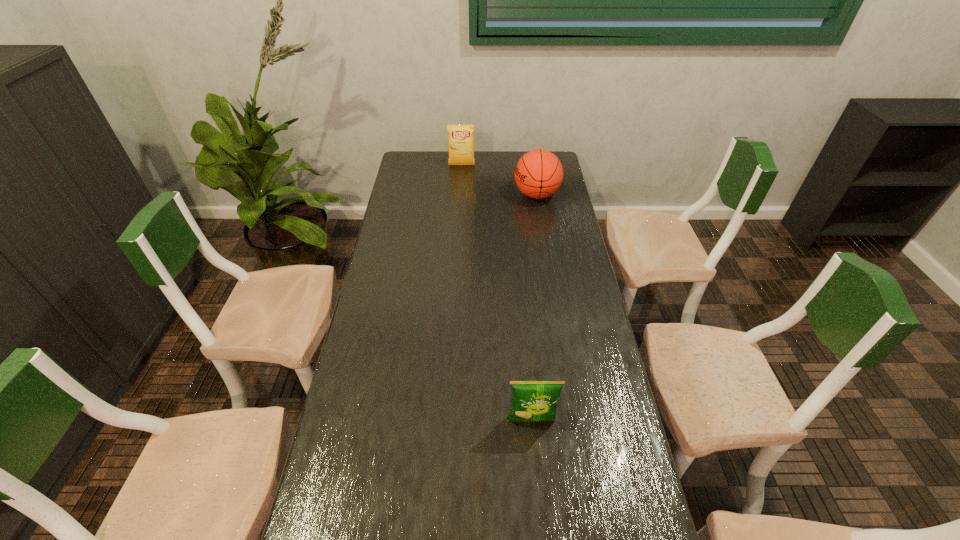
Identify the location of vacant space that's between the farthest object and the nearest object. The image size is (960, 540). (496, 293).

This screenshot has width=960, height=540. Find the location of `empty location between the right crisp (potato chip) and the basketball`. empty location between the right crisp (potato chip) and the basketball is located at coordinates (534, 307).

In order to click on empty space between the farther crisp (potato chip) and the right crisp (potato chip) in this screenshot , I will do `click(496, 293)`.

Locate an element on the screen. This screenshot has width=960, height=540. vacant space that's between the second nearest object and the right crisp (potato chip) is located at coordinates (534, 307).

Where is `free space between the nearer crisp (potato chip) and the leftmost object`? This screenshot has height=540, width=960. free space between the nearer crisp (potato chip) and the leftmost object is located at coordinates (496, 293).

Locate which object is the second closest to the second farthest object. Please provide its 2D coordinates. Your answer should be formatted as a tuple, i.e. [(x, y)], where the tuple contains the x and y coordinates of a point satisfying the conditions above.

[(532, 400)]

What are the coordinates of `the closest object to the basketball` in the screenshot? It's located at (460, 137).

Locate an element on the screen. The width and height of the screenshot is (960, 540). free space that satisfies the following two spatial constraints: 1. on the side with logo of the basketball; 2. on the front-facing side of the right crisp (potato chip) is located at coordinates point(574,420).

Image resolution: width=960 pixels, height=540 pixels. I want to click on free location that satisfies the following two spatial constraints: 1. on the side with logo of the second farthest object; 2. on the front-facing side of the nearer crisp (potato chip), so click(x=574, y=420).

Identify the location of free location that satisfies the following two spatial constraints: 1. on the side with logo of the second nearest object; 2. on the front-facing side of the nearer crisp (potato chip). The image size is (960, 540). (574, 420).